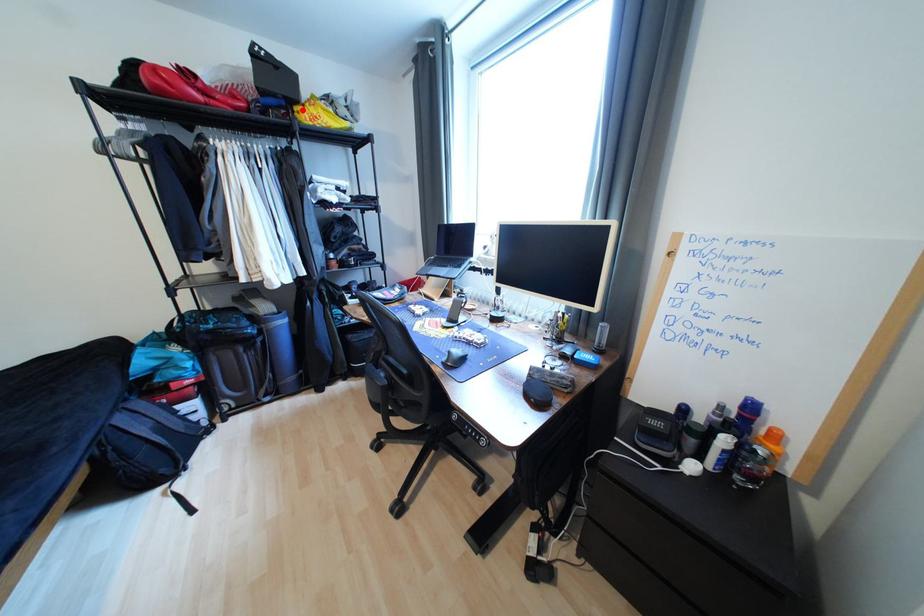
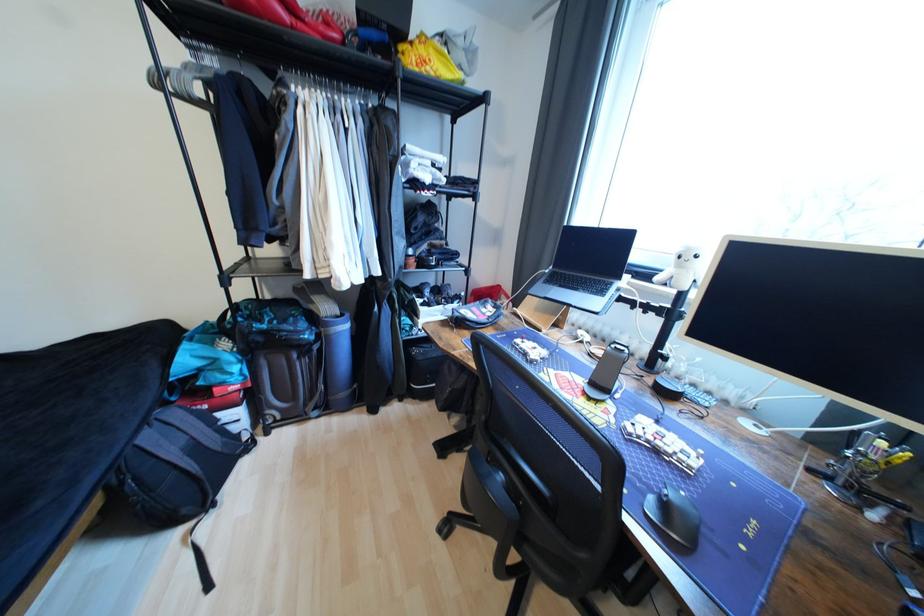
The point at the highlighted location is marked in the first image. Where is the corresponding point in the second image?

(407, 49)